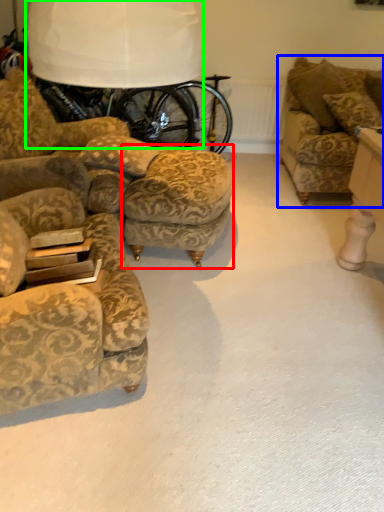
Question: Which object is positioned closest to stool (highlighted by a red box)? Select from studio couch (highlighted by a blue box) and table lamp (highlighted by a green box).

Choices:
 (A) studio couch
 (B) table lamp

Answer: (B)